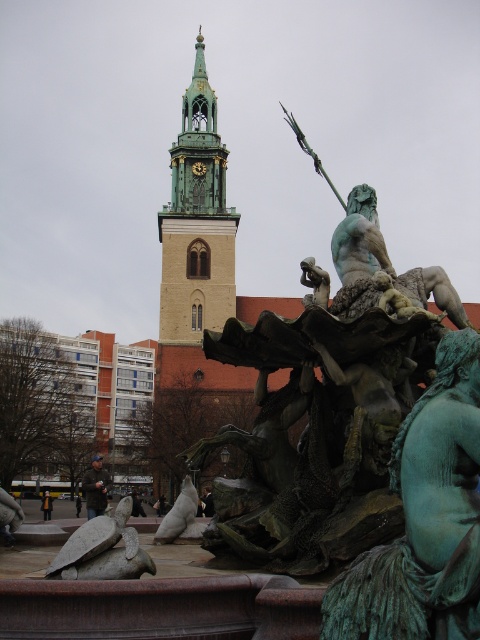
Looking at this image, you are an art student analyzing the fountain sculptures. You observe the green patina statue at center and the bronze statue at center. Which of these two statues has a smaller width?

The green patina statue at center has a smaller width than the bronze statue at center.

From the picture: You are an architect designing a new city plaza. You want to ensure that the green patina statue at center and the green copper bell tower at upper center are aligned in a way that creates a visual pathway for visitors. Based on their positions, which object is directly above the other, and how might this alignment enhance the visitor experience?

The green copper bell tower at upper center is directly above the green patina statue at center. This vertical alignment creates a striking visual pathway that draws the eye upward from the statue to the tower, enhancing the sense of grandeur and guiding visitors toward the focal points of the plaza.